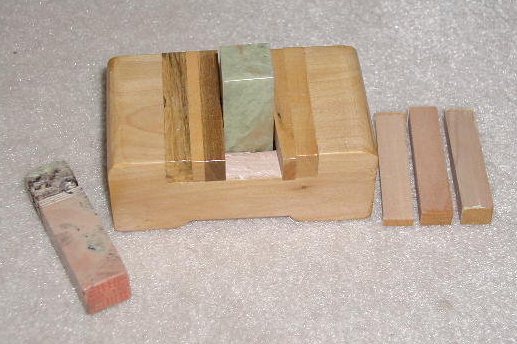
This screenshot has height=344, width=517. What are the coordinates of `carpet right of object` in the screenshot? It's located at (481, 73).